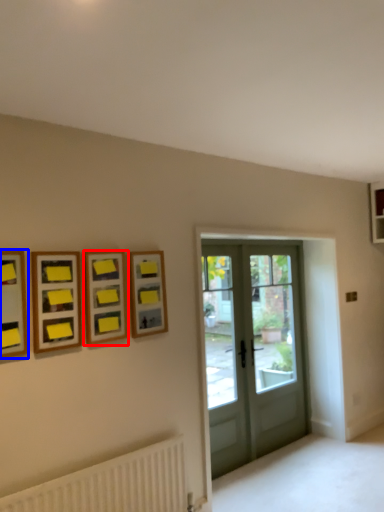
Question: Which object is closer to the camera taking this photo, picture frame (highlighted by a red box) or picture frame (highlighted by a blue box)?

Choices:
 (A) picture frame
 (B) picture frame

Answer: (B)